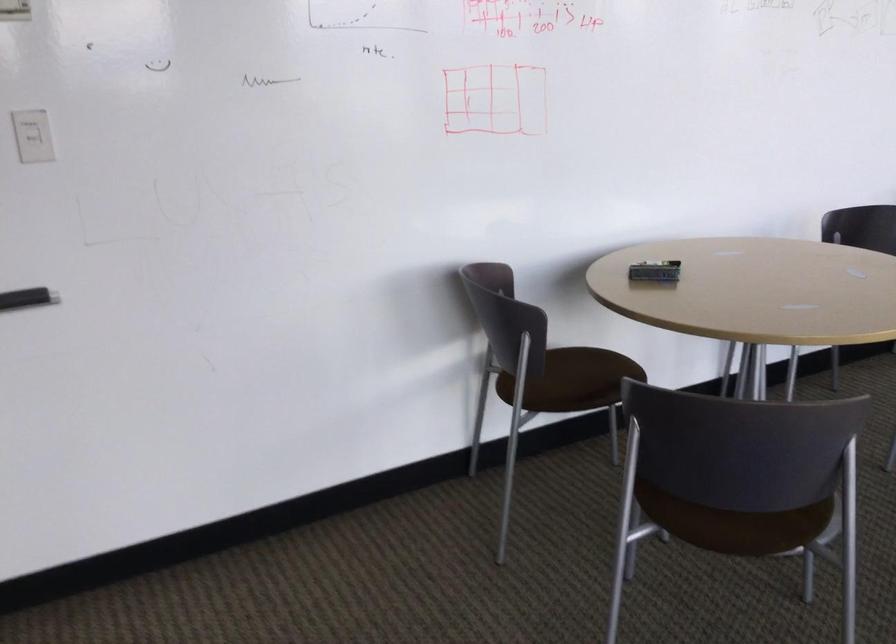
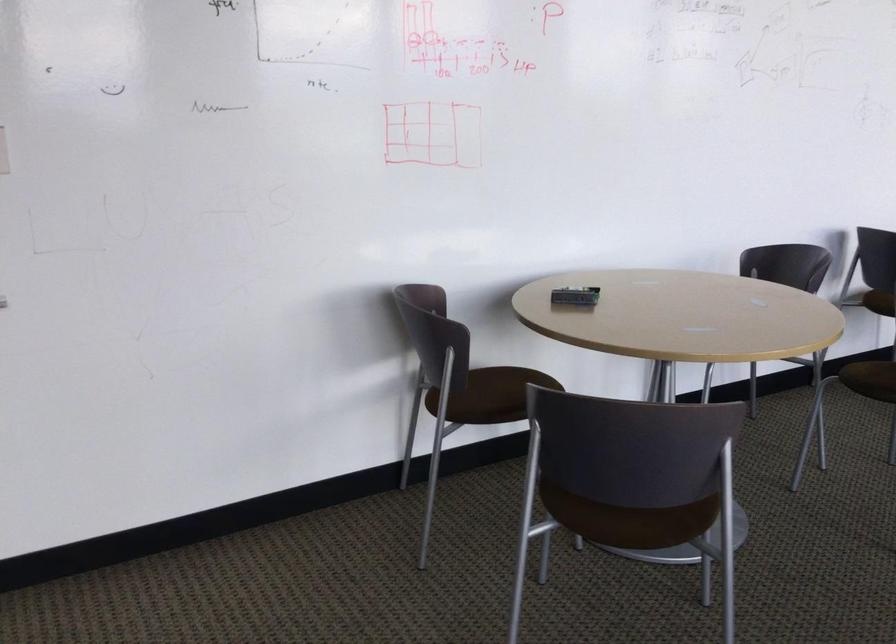
The point at (745,507) is marked in the first image. Where is the corresponding point in the second image?

(633, 505)